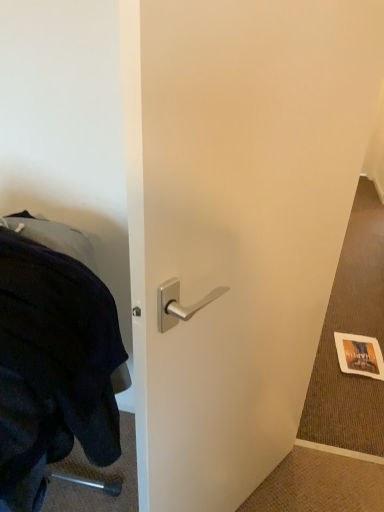
Question: From a real-world perspective, is gold textured paper at lower right located higher than black fabric at left?

Choices:
 (A) yes
 (B) no

Answer: (B)

Question: Is gold textured paper at lower right thinner than black fabric at left?

Choices:
 (A) no
 (B) yes

Answer: (B)

Question: Is gold textured paper at lower right wider than black fabric at left?

Choices:
 (A) no
 (B) yes

Answer: (A)

Question: Is gold textured paper at lower right not within black fabric at left?

Choices:
 (A) no
 (B) yes

Answer: (B)

Question: Is gold textured paper at lower right taller than black fabric at left?

Choices:
 (A) no
 (B) yes

Answer: (A)

Question: Is gold textured paper at lower right closer to camera compared to black fabric at left?

Choices:
 (A) no
 (B) yes

Answer: (A)

Question: Are black fabric at left and gold textured paper at lower right making contact?

Choices:
 (A) no
 (B) yes

Answer: (A)

Question: Is the depth of black fabric at left less than that of gold textured paper at lower right?

Choices:
 (A) no
 (B) yes

Answer: (B)

Question: From the image's perspective, would you say black fabric at left is positioned over gold textured paper at lower right?

Choices:
 (A) yes
 (B) no

Answer: (A)

Question: Can you confirm if black fabric at left is shorter than gold textured paper at lower right?

Choices:
 (A) yes
 (B) no

Answer: (B)

Question: Considering the relative positions of black fabric at left and gold textured paper at lower right in the image provided, is black fabric at left to the left of gold textured paper at lower right from the viewer's perspective?

Choices:
 (A) yes
 (B) no

Answer: (A)

Question: Is black fabric at left positioned with its back to gold textured paper at lower right?

Choices:
 (A) yes
 (B) no

Answer: (B)

Question: From the image's perspective, is gold textured paper at lower right under satin silver handle at center?

Choices:
 (A) no
 (B) yes

Answer: (B)